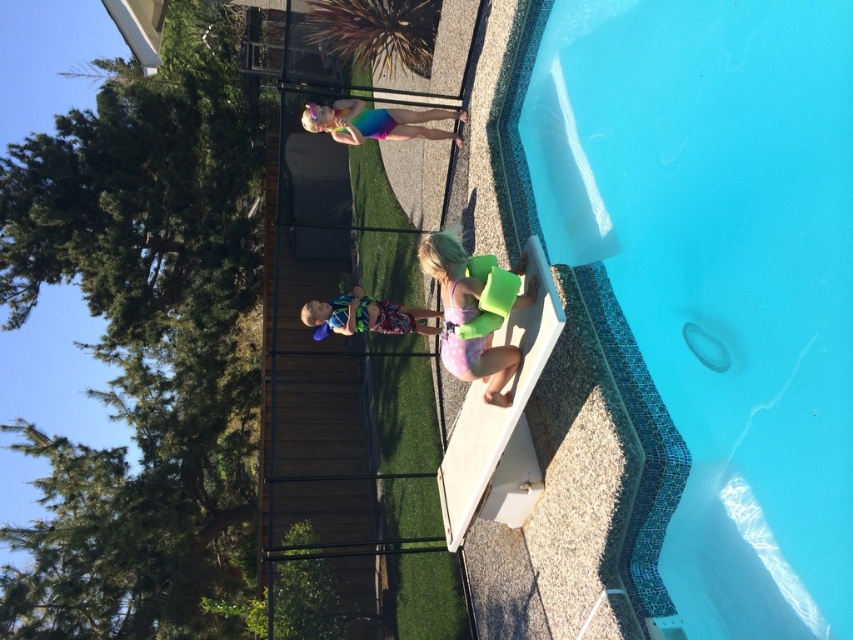
You are planning to place the green foam float at lower center next to the blue printed shorts at center. Considering their sizes, which one will require more space horizontally?

The blue printed shorts at center requires more horizontal space because its width is greater than the green foam float at lower center.

You are a photographer taking a picture of the blue mosaic tile at upper right and the rainbow swimsuit at upper center. Which object is closer to the bottom edge of the photo?

The blue mosaic tile at upper right is positioned under the rainbow swimsuit at upper center, so it is closer to the bottom edge of the photo.